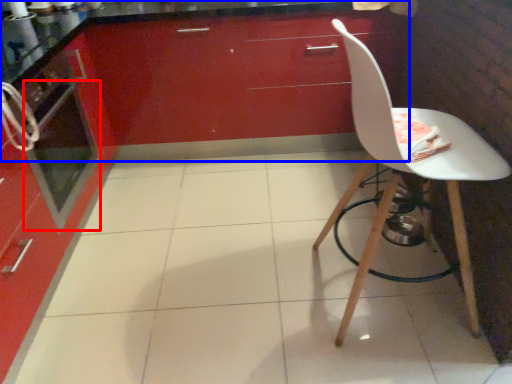
Question: Which point is closer to the camera, oven (highlighted by a red box) or cabinetry (highlighted by a blue box)?

Choices:
 (A) oven
 (B) cabinetry

Answer: (A)